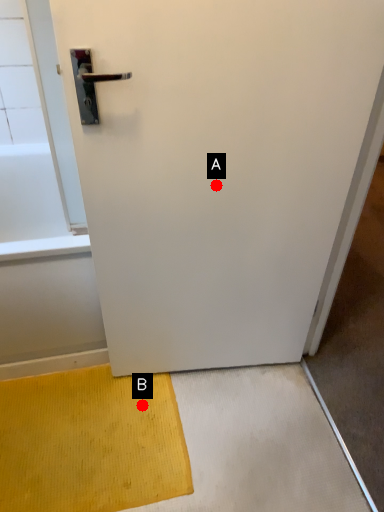
Question: Two points are circled on the image, labeled by A and B beside each circle. Which point is farther from the camera taking this photo?

Choices:
 (A) A is further
 (B) B is further

Answer: (B)